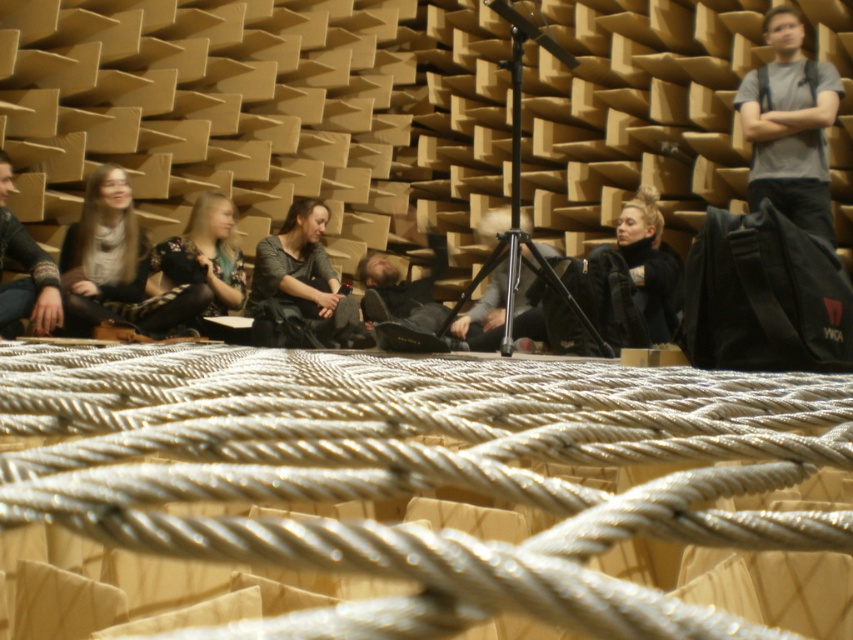
Is point (317, 246) closer to viewer compared to point (1, 292)?

No, (317, 246) is further to viewer.

Can you confirm if dark gray fabric jacket at center is wider than matte black sweater at left?

Yes.

This screenshot has height=640, width=853. Describe the element at coordinates (300, 288) in the screenshot. I see `dark gray fabric jacket at center` at that location.

Locate an element on the screen. This screenshot has width=853, height=640. dark gray fabric jacket at center is located at coordinates (300, 288).

Does gray cotton t-shirt at upper right have a greater width compared to dark gray fabric jacket at center?

No, gray cotton t-shirt at upper right is not wider than dark gray fabric jacket at center.

Can you confirm if gray cotton t-shirt at upper right is shorter than dark gray fabric jacket at center?

No, gray cotton t-shirt at upper right is not shorter than dark gray fabric jacket at center.

Is point (811, 90) more distant than point (277, 291)?

No, it is in front of (277, 291).

You are a GUI agent. You are given a task and a screenshot of the screen. Output one action in this format:
    pyautogui.click(x=<x>, y=<y>)
    Task: Click on the gray cotton t-shirt at upper right
    
    Given the screenshot: What is the action you would take?
    pyautogui.click(x=788, y=125)

Does silver metallic rope at center appear over black fur coat at center?

No, silver metallic rope at center is not above black fur coat at center.

Is silver metallic rope at center bigger than black fur coat at center?

Incorrect, silver metallic rope at center is not larger than black fur coat at center.

Between point (485, 420) and point (653, 220), which one is positioned in front?

Point (485, 420) is more forward.

Find the location of a particular element. silver metallic rope at center is located at coordinates (416, 468).